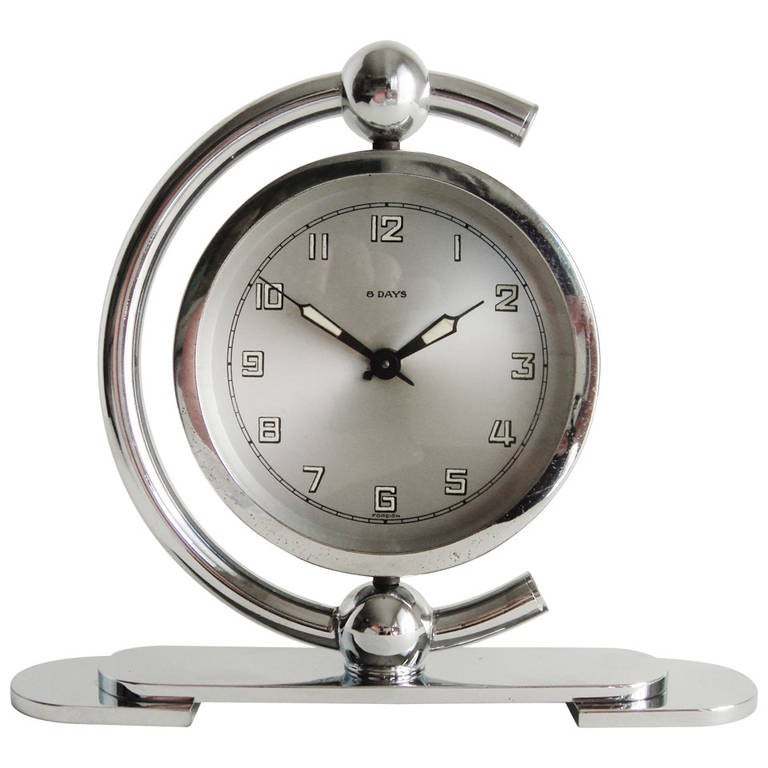
This screenshot has width=768, height=768. I want to click on stand, so click(402, 627).